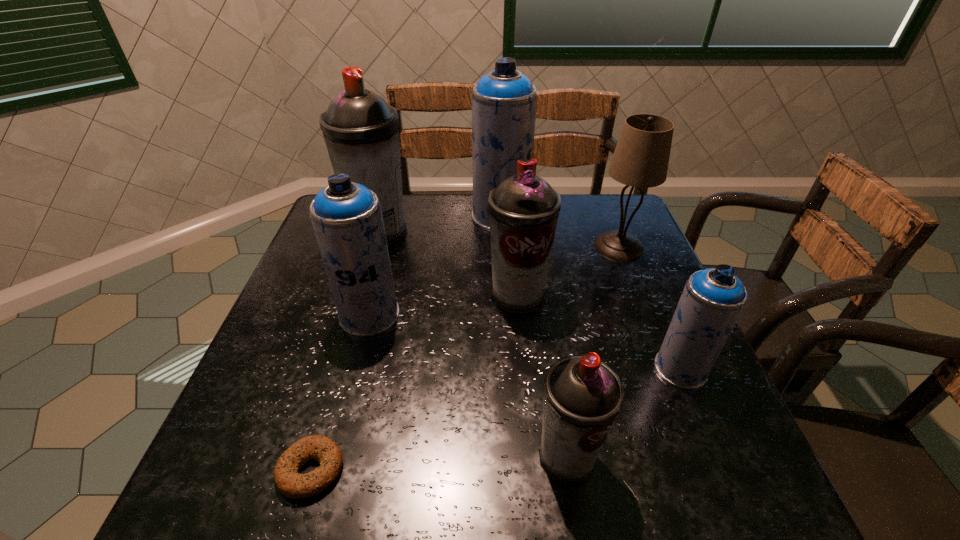
Find the location of `blank region between the nearest aerosol can and the second biggest gray aerosol can`. blank region between the nearest aerosol can and the second biggest gray aerosol can is located at coordinates (542, 376).

The image size is (960, 540). I want to click on vacant space that's between the lampshade and the second farthest gray aerosol can, so click(x=568, y=271).

Where is `free space between the shortest object and the second smallest blue aerosol can`? free space between the shortest object and the second smallest blue aerosol can is located at coordinates (340, 392).

The width and height of the screenshot is (960, 540). In order to click on free point between the smallest blue aerosol can and the leftmost blue aerosol can in this screenshot , I will do `click(525, 342)`.

The width and height of the screenshot is (960, 540). I want to click on empty location between the brown bagel and the biggest gray aerosol can, so click(346, 350).

In order to click on vacant space that's between the second blue aerosol can from left to right and the bagel in this screenshot , I will do `click(406, 343)`.

At what (x,y) coordinates should I click in order to perform the action: click on free area in between the lampshade and the bagel. Please return your answer as a coordinate pair (x, y). Image resolution: width=960 pixels, height=540 pixels. Looking at the image, I should click on (465, 358).

Identify the location of vacant area between the rightmost blue aerosol can and the lampshade. The image size is (960, 540). (650, 307).

Find the location of a particular element. object that is the sixth nearest to the rightmost blue aerosol can is located at coordinates (289, 482).

Identify which object is the seventh nearest to the rightmost blue aerosol can. Please provide its 2D coordinates. Your answer should be formatted as a tuple, i.e. [(x, y)], where the tuple contains the x and y coordinates of a point satisfying the conditions above.

[(361, 131)]